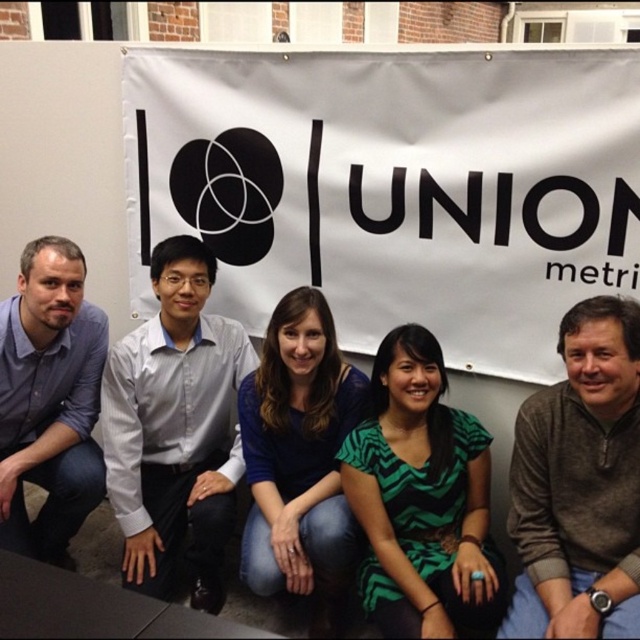
You are organizing a photo shoot and need to ensure that all participants are visible in the final image. You notice the light gray shirt at center and the brown sweater at right. Which clothing item is covering part of the other in the photo?

The light gray shirt at center is positioned over brown sweater at right, so it is covering part of the brown sweater at right.

You are organizing a photo shoot and need to ensure that all clothing items in the image are visible. Given that the brown sweater at right and the blue fabric shirt at center are part of the group, which clothing item is smaller and might require closer inspection to ensure visibility?

The brown sweater at right is smaller than the blue fabric shirt at center, so it might require closer inspection to ensure visibility.